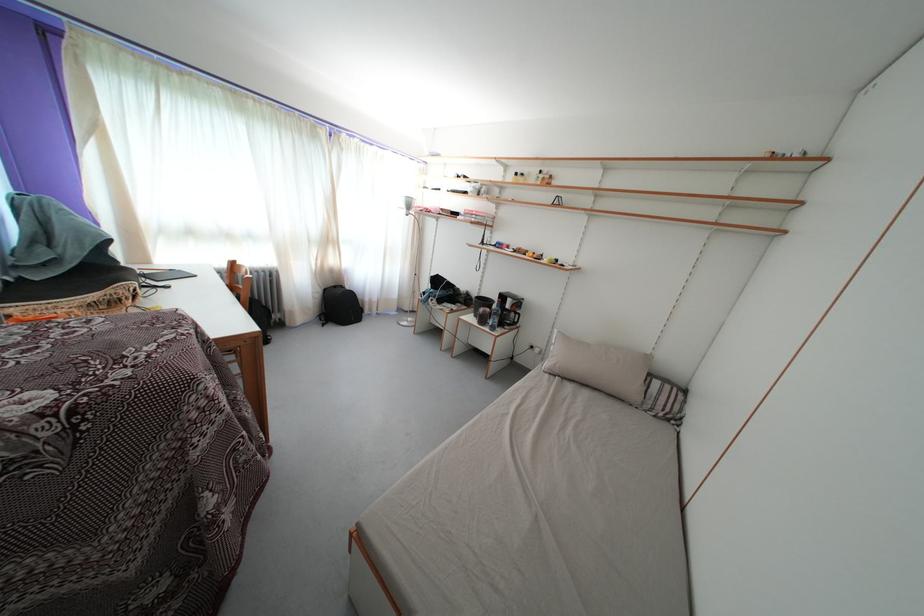
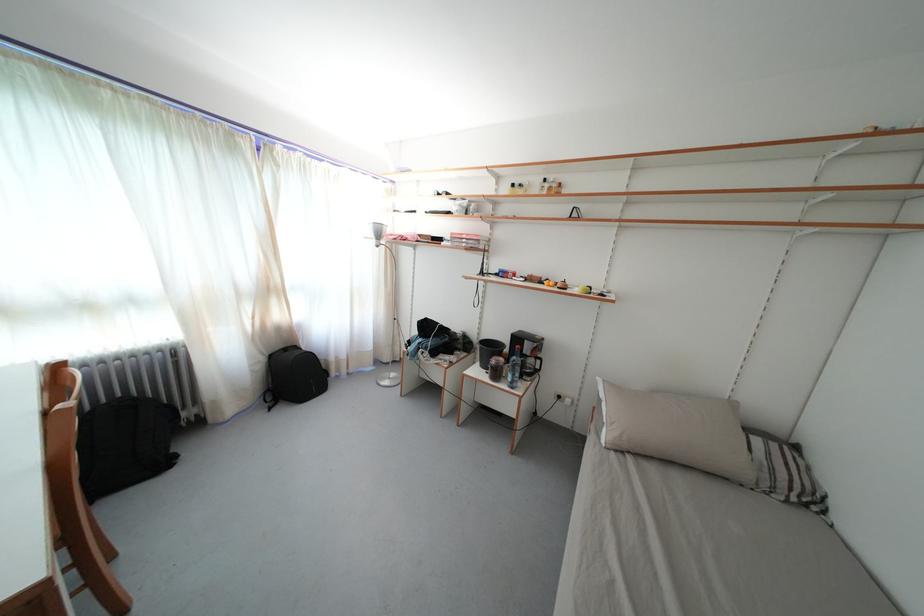
In the second image, find the point that corresponds to point 273,314 in the first image.

(175, 411)